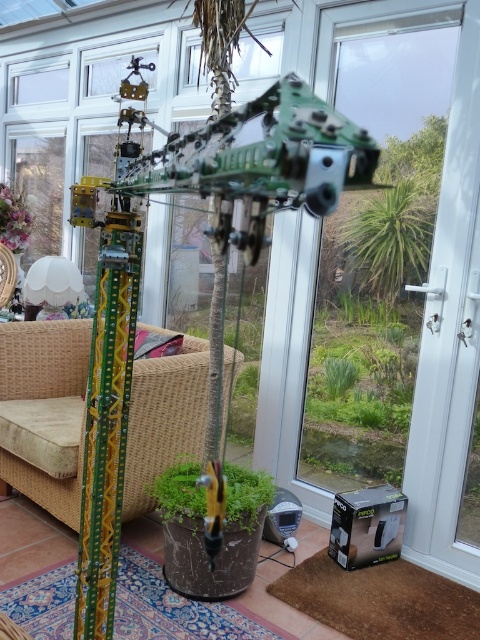
Question: Which point is farther from the camera taking this photo?

Choices:
 (A) (130, 484)
 (B) (36, 298)

Answer: (B)

Question: Is wicker armchair at lower left above white fabric lampshade at lower left?

Choices:
 (A) no
 (B) yes

Answer: (A)

Question: Is wicker armchair at lower left to the left of white fabric lampshade at lower left from the viewer's perspective?

Choices:
 (A) yes
 (B) no

Answer: (B)

Question: Among these points, which one is farthest from the camera?

Choices:
 (A) (78, 296)
 (B) (72, 420)

Answer: (A)

Question: Which object is closer to the camera taking this photo?

Choices:
 (A) white fabric lampshade at lower left
 (B) wicker armchair at lower left

Answer: (B)

Question: Is wicker armchair at lower left positioned behind white fabric lampshade at lower left?

Choices:
 (A) yes
 (B) no

Answer: (B)